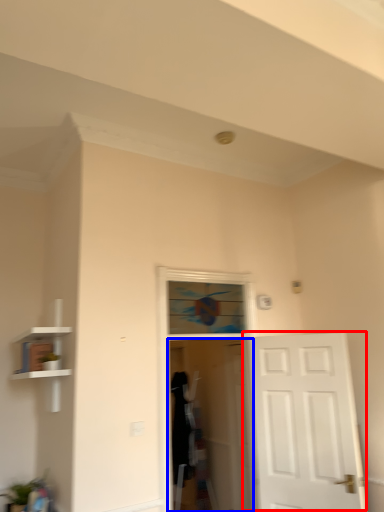
Question: Which point is further to the camera, door (highlighted by a red box) or screen door (highlighted by a blue box)?

Choices:
 (A) door
 (B) screen door

Answer: (B)